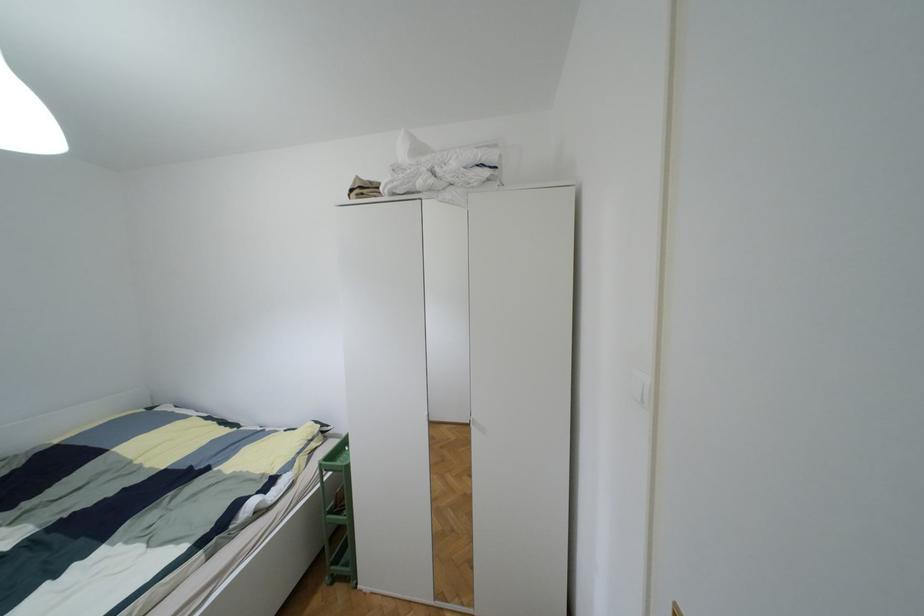
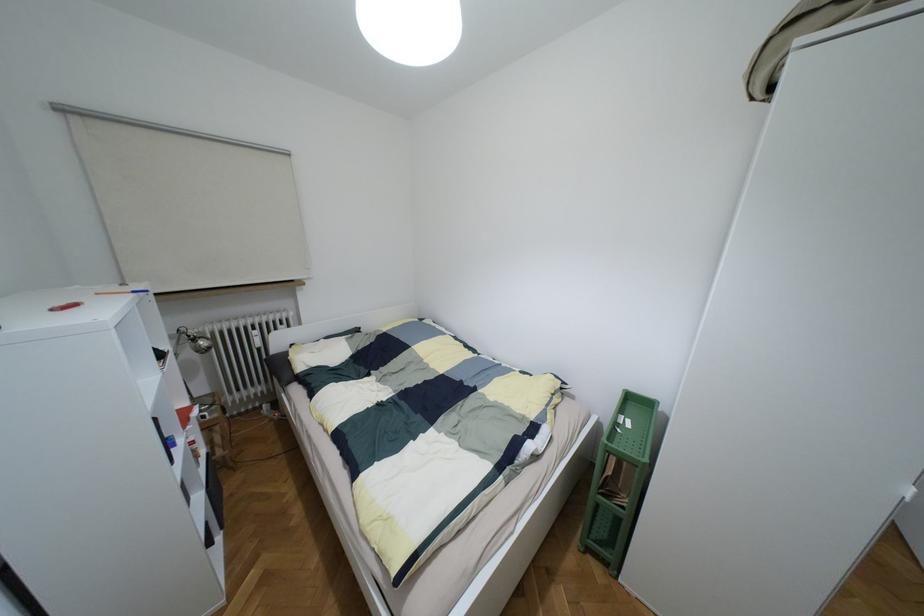
Question: The camera is either moving clockwise (left) or counter-clockwise (right) around the object. The first image is from the beginning of the video and the second image is from the end. Is the camera moving left or right when shooting the video?

Choices:
 (A) Left
 (B) Right

Answer: (B)